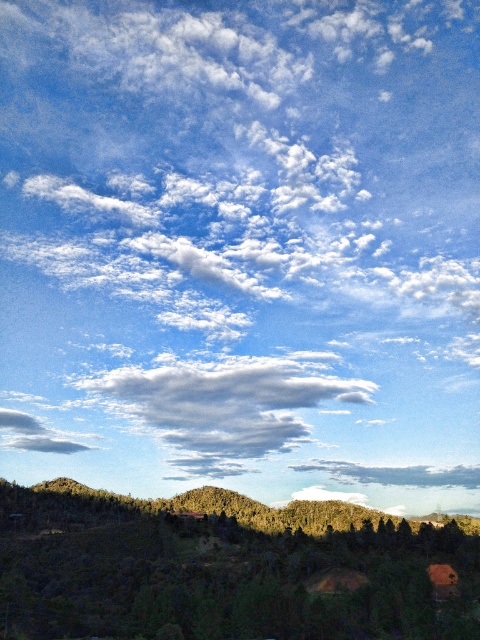
You are an airplane passenger looking out the window and see the green textured hillside at lower left and the cloudy sky at center. Which object is closer to the airplane?

The green textured hillside at lower left is closer to the airplane because it is positioned under the cloudy sky at center, indicating it is lower in elevation.

You are standing at the point marked as point (225, 568) in the image. What do you see around you?

You are standing on the green textured hillside at lower left, which is located at point (225, 568).